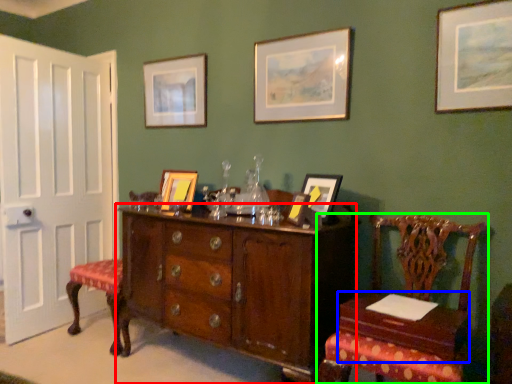
Question: Which object is the closest to the cabinetry (highlighted by a red box)? Choose among these: table (highlighted by a blue box) or chair (highlighted by a green box).

Choices:
 (A) table
 (B) chair

Answer: (B)